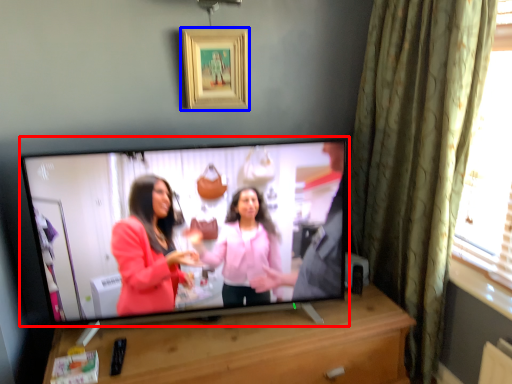
Question: Which object appears closest to the camera in this image, television (highlighted by a red box) or picture frame (highlighted by a blue box)?

Choices:
 (A) television
 (B) picture frame

Answer: (A)